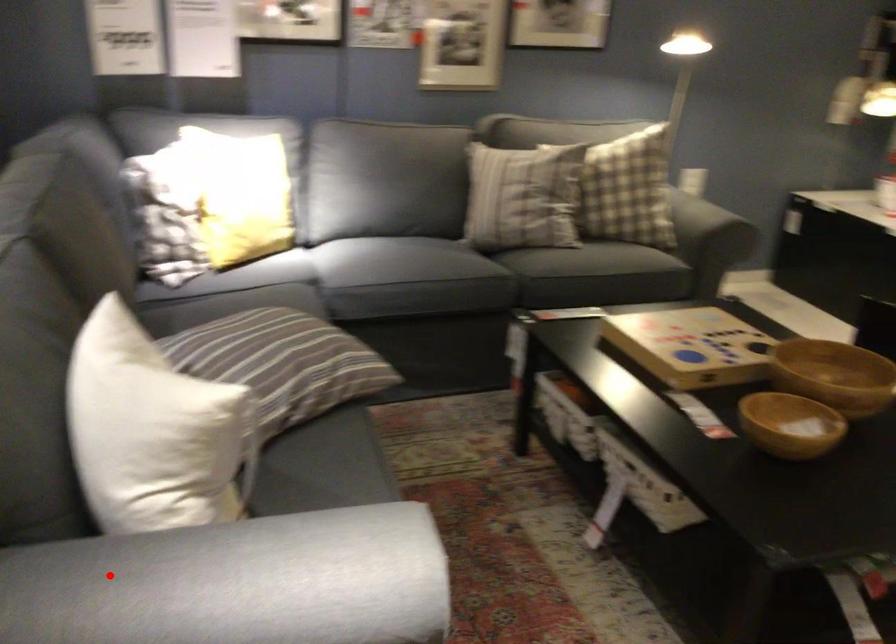
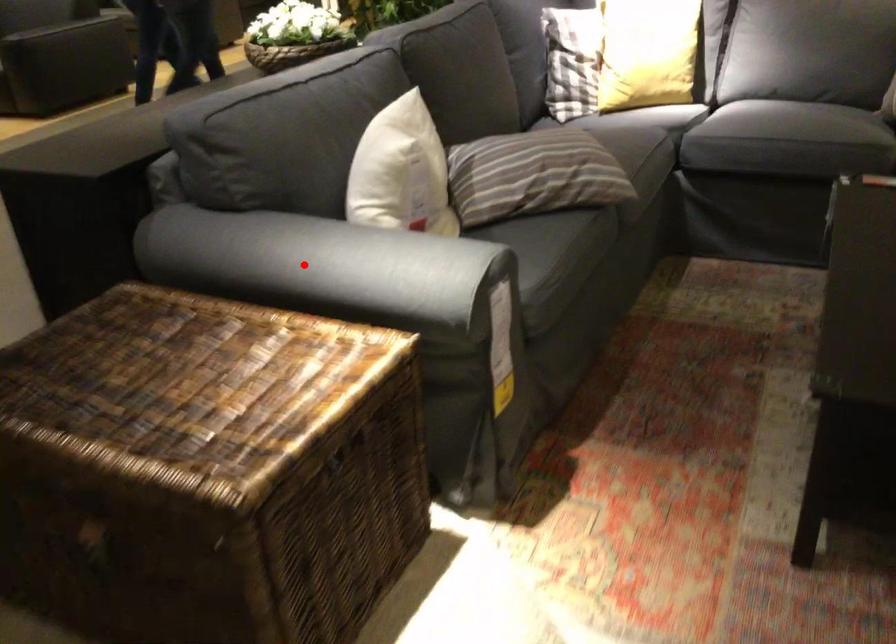
I am providing you with two images of the same scene from different viewpoints. A red point is marked on the first image and another point is marked on the second image. Do the highlighted points in image1 and image2 indicate the same real-world spot?

Yes